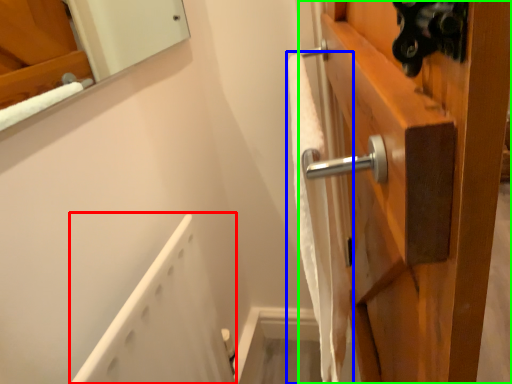
Question: Estimate the real-world distances between objects in this image. Which object is farther from bath (highlighted by a red box), bath towel (highlighted by a blue box) or door (highlighted by a green box)?

Choices:
 (A) bath towel
 (B) door

Answer: (B)